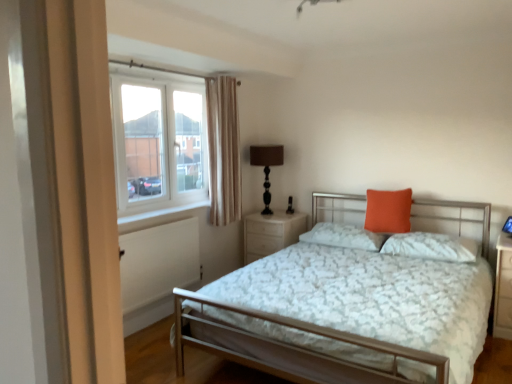
Question: Is brown fabric-covered lamp at upper right far away from beige fabric curtain at upper left?

Choices:
 (A) yes
 (B) no

Answer: (B)

Question: Considering the relative sizes of brown fabric-covered lamp at upper right and beige fabric curtain at upper left in the image provided, is brown fabric-covered lamp at upper right shorter than beige fabric curtain at upper left?

Choices:
 (A) no
 (B) yes

Answer: (B)

Question: Is brown fabric-covered lamp at upper right facing away from beige fabric curtain at upper left?

Choices:
 (A) yes
 (B) no

Answer: (B)

Question: Does brown fabric-covered lamp at upper right have a lesser width compared to beige fabric curtain at upper left?

Choices:
 (A) yes
 (B) no

Answer: (B)

Question: Is brown fabric-covered lamp at upper right aimed at beige fabric curtain at upper left?

Choices:
 (A) no
 (B) yes

Answer: (B)

Question: Is brown fabric-covered lamp at upper right located outside beige fabric curtain at upper left?

Choices:
 (A) no
 (B) yes

Answer: (B)

Question: From a real-world perspective, is white textured pillow at center, which is counted as the first pillow, starting from the right, on orange matte pillow at upper right, which is the 2th pillow in left-to-right order?

Choices:
 (A) no
 (B) yes

Answer: (A)

Question: Considering the relative sizes of white textured pillow at center, which is counted as the first pillow, starting from the right, and orange matte pillow at upper right, the second pillow when ordered from right to left, in the image provided, is white textured pillow at center, which is counted as the first pillow, starting from the right, thinner than orange matte pillow at upper right, the second pillow when ordered from right to left,?

Choices:
 (A) no
 (B) yes

Answer: (A)

Question: Can you confirm if white textured pillow at center, which is counted as the first pillow, starting from the right, is positioned to the right of orange matte pillow at upper right, which is the 2th pillow in left-to-right order?

Choices:
 (A) yes
 (B) no

Answer: (A)

Question: Considering the relative sizes of white textured pillow at center, which is counted as the first pillow, starting from the right, and orange matte pillow at upper right, which is the 2th pillow in left-to-right order, in the image provided, is white textured pillow at center, which is counted as the first pillow, starting from the right, smaller than orange matte pillow at upper right, which is the 2th pillow in left-to-right order,?

Choices:
 (A) yes
 (B) no

Answer: (B)

Question: Are white textured pillow at center, which is counted as the first pillow, starting from the right, and orange matte pillow at upper right, the second pillow when ordered from right to left, beside each other?

Choices:
 (A) no
 (B) yes

Answer: (A)

Question: Is white textured pillow at center, which is counted as the first pillow, starting from the right, positioned before orange matte pillow at upper right, the second pillow when ordered from right to left?

Choices:
 (A) yes
 (B) no

Answer: (A)

Question: Does white textured pillow at center, which is counted as the first pillow, starting from the right, touch white painted wood at lower left?

Choices:
 (A) no
 (B) yes

Answer: (A)